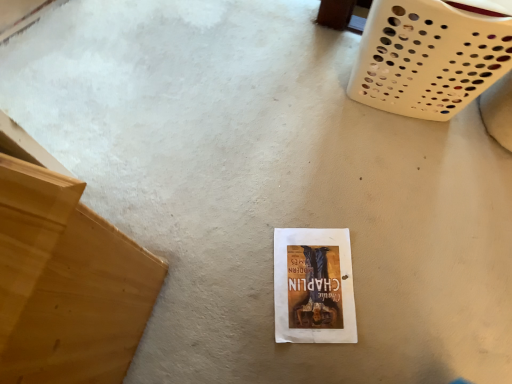
Question: From the image's perspective, is white plastic basket at upper right positioned above or below white paper at center?

Choices:
 (A) above
 (B) below

Answer: (A)

Question: Based on their positions, is white plastic basket at upper right located to the left or right of white paper at center?

Choices:
 (A) left
 (B) right

Answer: (B)

Question: Based on their relative distances, which object is farther from the white paper at center?

Choices:
 (A) white plastic basket at upper right
 (B) light brown wood at left

Answer: (A)

Question: Which object is the closest to the white plastic basket at upper right?

Choices:
 (A) white paper at center
 (B) light brown wood at left

Answer: (A)